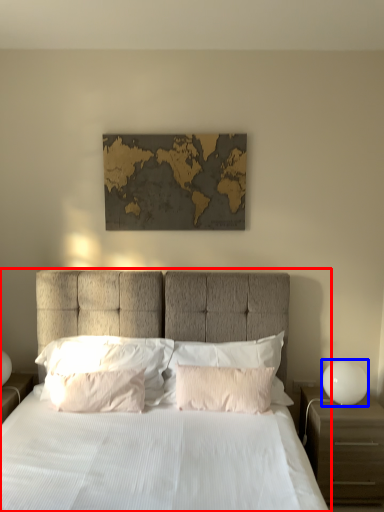
Question: Among these objects, which one is nearest to the camera, bed (highlighted by a red box) or bedside lamp (highlighted by a blue box)?

Choices:
 (A) bed
 (B) bedside lamp

Answer: (A)